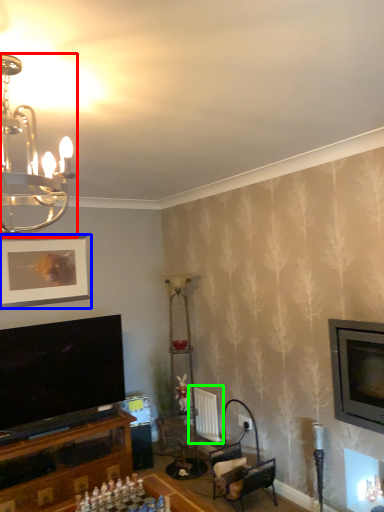
Question: Estimate the real-world distances between objects in this image. Which object is farther from lamp (highlighted by a red box), picture frame (highlighted by a blue box) or radiator (highlighted by a green box)?

Choices:
 (A) picture frame
 (B) radiator

Answer: (B)